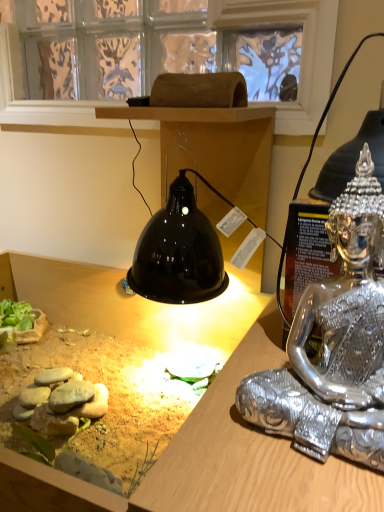
The height and width of the screenshot is (512, 384). I want to click on vacant space to the left of silver metallic statue at right, so click(x=195, y=450).